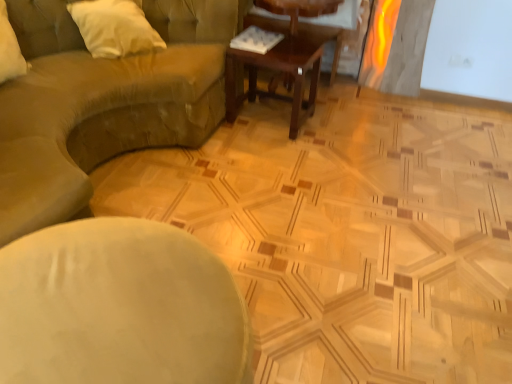
Question: Is white soft pillow at upper left wider than wooden coffee table at center?

Choices:
 (A) no
 (B) yes

Answer: (A)

Question: Can you confirm if white soft pillow at upper left is positioned to the left of wooden coffee table at center?

Choices:
 (A) yes
 (B) no

Answer: (A)

Question: Would you say white soft pillow at upper left contains wooden coffee table at center?

Choices:
 (A) yes
 (B) no

Answer: (B)

Question: Is white soft pillow at upper left closer to the viewer compared to wooden coffee table at center?

Choices:
 (A) no
 (B) yes

Answer: (B)

Question: Is white soft pillow at upper left not inside wooden coffee table at center?

Choices:
 (A) yes
 (B) no

Answer: (A)

Question: Does point (207, 8) appear closer or farther from the camera than point (94, 39)?

Choices:
 (A) closer
 (B) farther

Answer: (B)

Question: Is suede-like beige couch at upper left inside the boundaries of white soft pillow at upper left, or outside?

Choices:
 (A) inside
 (B) outside

Answer: (B)

Question: Looking at the image, does suede-like beige couch at upper left seem bigger or smaller compared to white soft pillow at upper left?

Choices:
 (A) big
 (B) small

Answer: (A)

Question: Considering the positions of suede-like beige couch at upper left and white soft pillow at upper left in the image, is suede-like beige couch at upper left wider or thinner than white soft pillow at upper left?

Choices:
 (A) thin
 (B) wide

Answer: (B)

Question: Based on their positions, is white soft pillow at upper left located to the left or right of wooden cocktail table at center?

Choices:
 (A) left
 (B) right

Answer: (A)

Question: From the image's perspective, relative to wooden cocktail table at center, is white soft pillow at upper left above or below?

Choices:
 (A) above
 (B) below

Answer: (B)

Question: Is point (90, 51) positioned closer to the camera than point (286, 8)?

Choices:
 (A) farther
 (B) closer

Answer: (B)

Question: In the image, is white soft pillow at upper left positioned in front of or behind wooden cocktail table at center?

Choices:
 (A) behind
 (B) front

Answer: (B)

Question: Is wooden cocktail table at center situated inside white soft pillow at upper left or outside?

Choices:
 (A) outside
 (B) inside

Answer: (A)

Question: Considering the positions of wooden cocktail table at center and white soft pillow at upper left in the image, is wooden cocktail table at center wider or thinner than white soft pillow at upper left?

Choices:
 (A) thin
 (B) wide

Answer: (A)